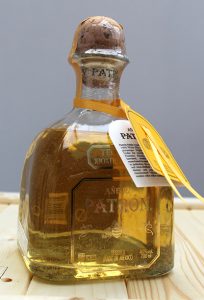
Image resolution: width=204 pixels, height=300 pixels. I want to click on glass liquor bottle, so click(x=89, y=185).